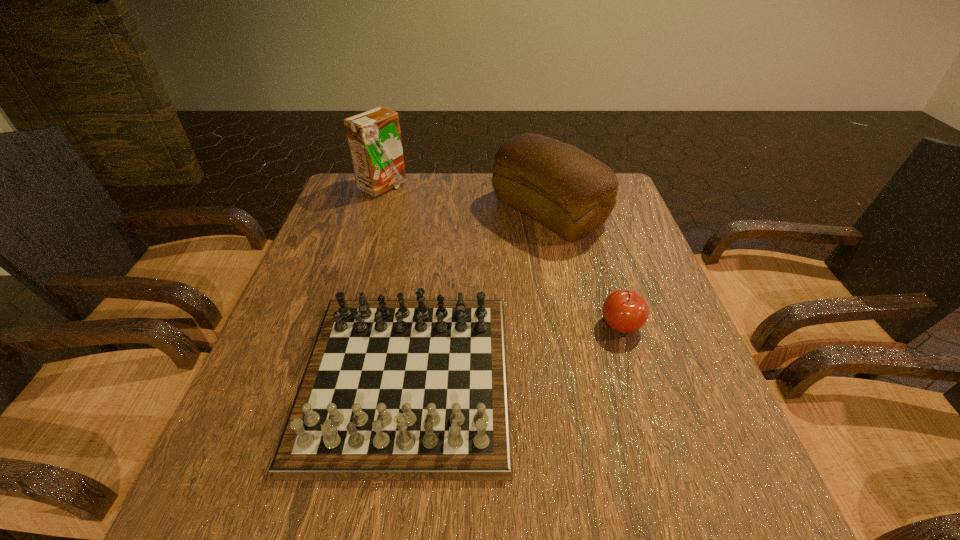
The image size is (960, 540). In the image, there is a desktop. Find the location of `vacant space at the left edge`. vacant space at the left edge is located at coordinates (251, 413).

Where is `vacant region at the right edge of the desktop`? This screenshot has height=540, width=960. vacant region at the right edge of the desktop is located at coordinates (707, 467).

The height and width of the screenshot is (540, 960). I want to click on free point at the far left corner, so click(x=345, y=196).

The image size is (960, 540). In order to click on vacant area between the carton and the bread in this screenshot , I will do `click(466, 199)`.

The height and width of the screenshot is (540, 960). I want to click on free space between the carton and the chessboard, so click(395, 282).

Find the location of `vacant area that lies between the carton and the apple`. vacant area that lies between the carton and the apple is located at coordinates (502, 256).

Locate an element on the screen. free spot between the chessboard and the apple is located at coordinates (514, 352).

The width and height of the screenshot is (960, 540). In order to click on empty space that is in between the chessboard and the apple in this screenshot , I will do `click(514, 352)`.

Image resolution: width=960 pixels, height=540 pixels. I want to click on vacant space that's between the bread and the apple, so click(585, 268).

At what (x,y) coordinates should I click in order to perform the action: click on free space between the bread and the apple. Please return your answer as a coordinate pair (x, y). The height and width of the screenshot is (540, 960). Looking at the image, I should click on (585, 268).